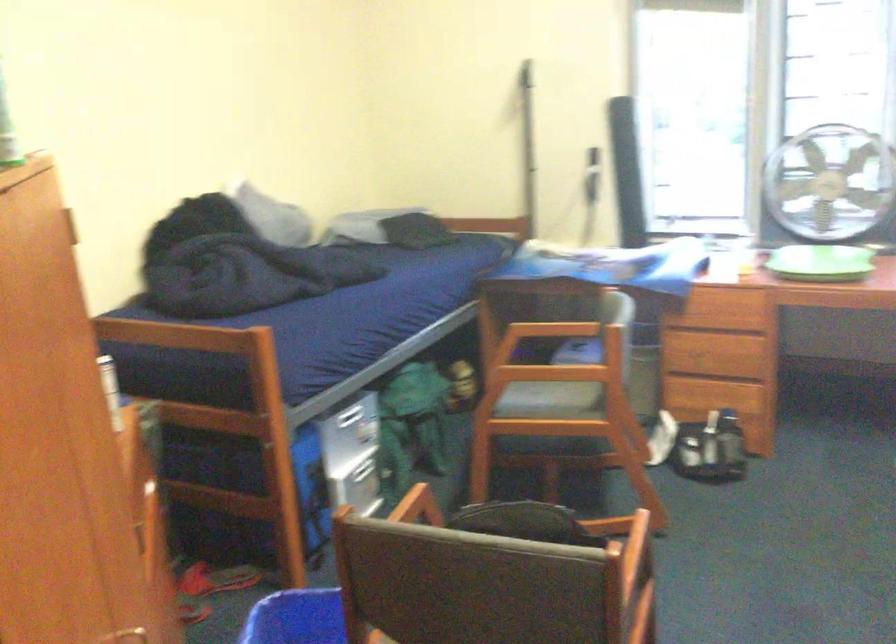
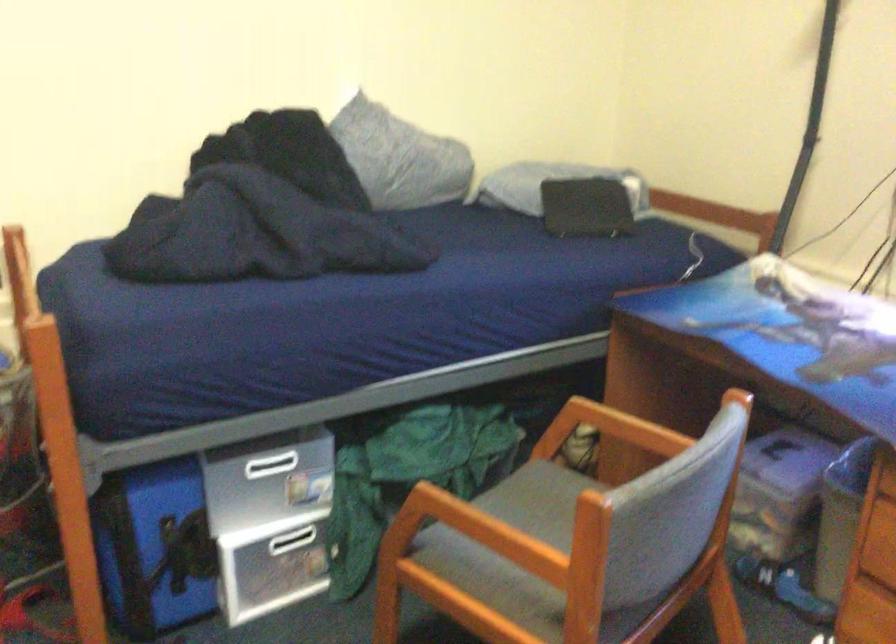
The point at (513, 391) is marked in the first image. Where is the corresponding point in the second image?

(519, 518)